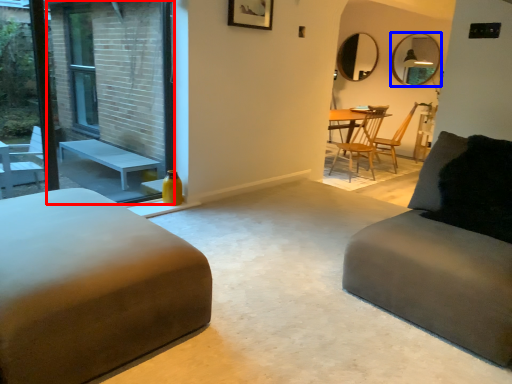
Question: Among these objects, which one is nearest to the camera, screen door (highlighted by a red box) or mirror (highlighted by a blue box)?

Choices:
 (A) screen door
 (B) mirror

Answer: (A)